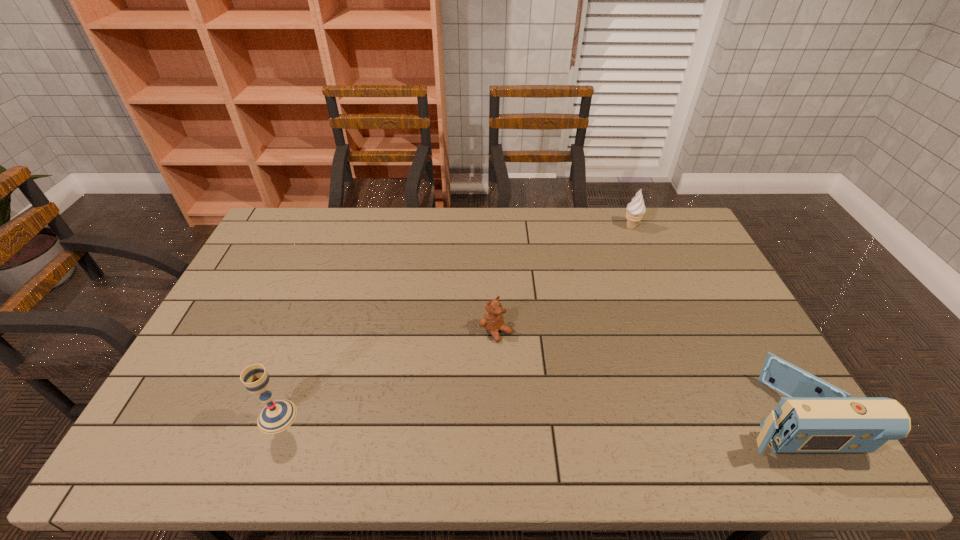
This screenshot has width=960, height=540. Find the location of `free point that satisfies the following two spatial constraints: 1. on the front side of the icecream; 2. on the side of the camcorder with the flip-out screen`. free point that satisfies the following two spatial constraints: 1. on the front side of the icecream; 2. on the side of the camcorder with the flip-out screen is located at coordinates (708, 416).